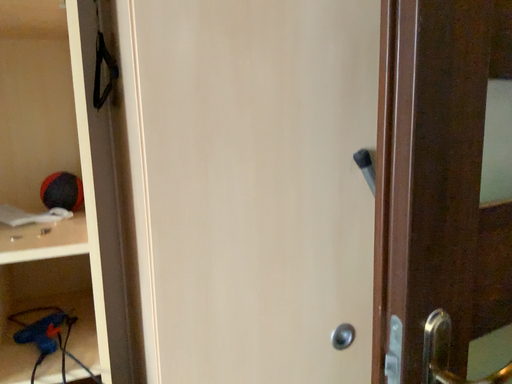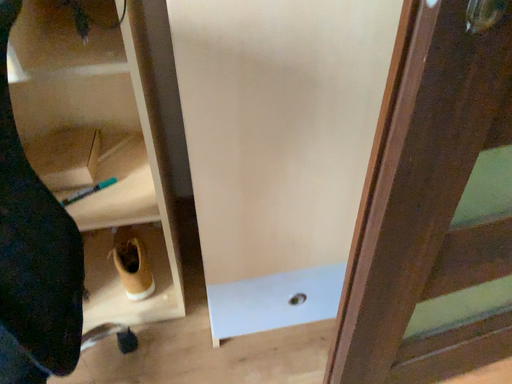
Question: Which way did the camera rotate in the video?

Choices:
 (A) rotated downward
 (B) rotated upward

Answer: (A)